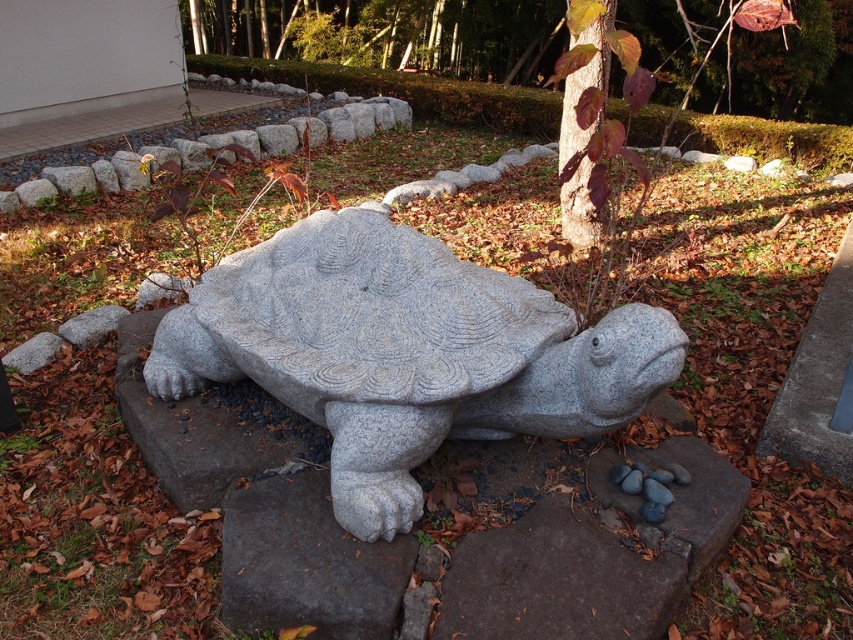
You are a gardener who wants to place a new decorative item between the granite tortoise at center and the green textured tree at upper center. Considering their heights, which object should the item be placed closer to?

Since the granite tortoise at center is shorter than the green textured tree at upper center, the new decorative item should be placed closer to the granite tortoise at center to maintain visual balance.

You are designing a garden layout and need to place a new decorative pot between the granite tortoise at center and the smooth bark tree at center. Given their sizes, which object should the pot be closer to to ensure it doesn

The granite tortoise at center is wider than the smooth bark tree at center, so the decorative pot should be placed closer to the smooth bark tree at center to maintain balance between the two objects.

You are a gardener who wants to place a new decorative rock in the garden. You need to ensure it won not block the view of the green textured tree at upper center from where you are standing. Where should you avoid placing the new decorative rock relative to the granite tortoise at center?

You should avoid placing the new decorative rock in front of the granite tortoise at center, as it is already blocking the view of the green textured tree at upper center. Placing the rock in front would further obstruct the view.